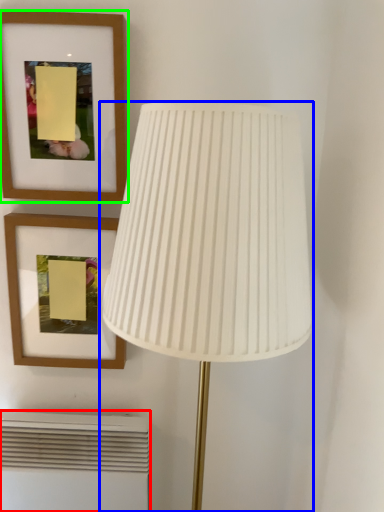
Question: Estimate the real-world distances between objects in this image. Which object is closer to air conditioner (highlighted by a red box), lamp (highlighted by a blue box) or picture frame (highlighted by a green box)?

Choices:
 (A) lamp
 (B) picture frame

Answer: (A)